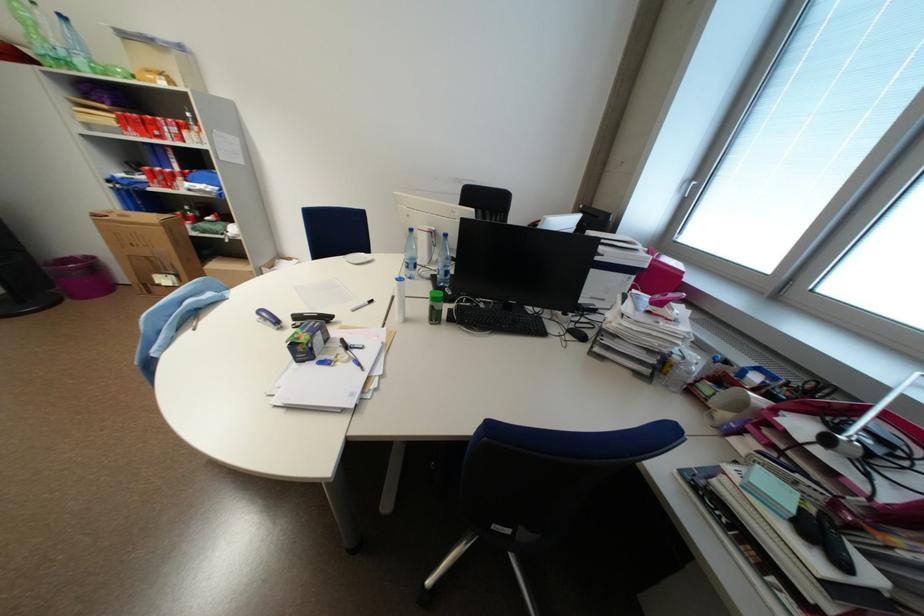
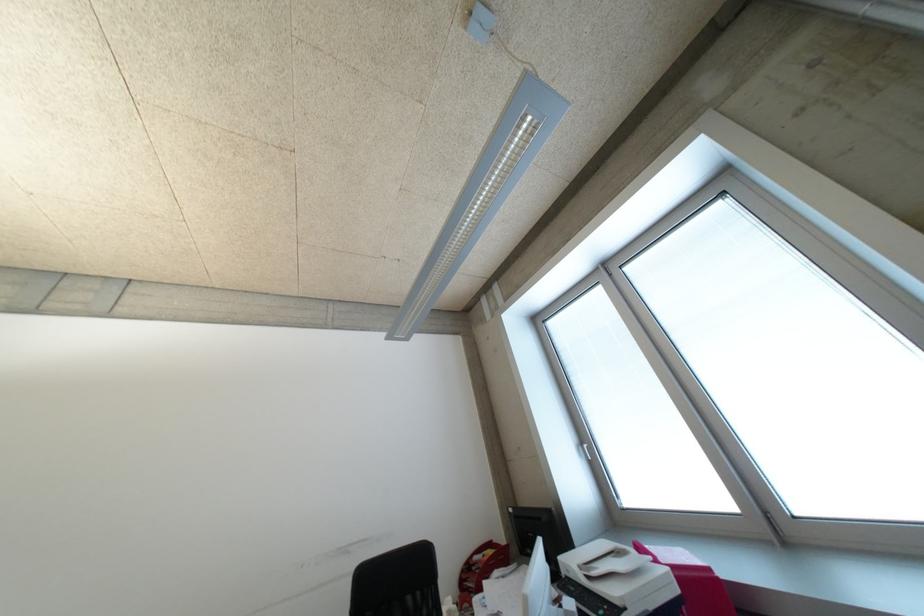
Locate, in the second image, the point that corresponds to pixel 695 185 in the first image.

(589, 450)